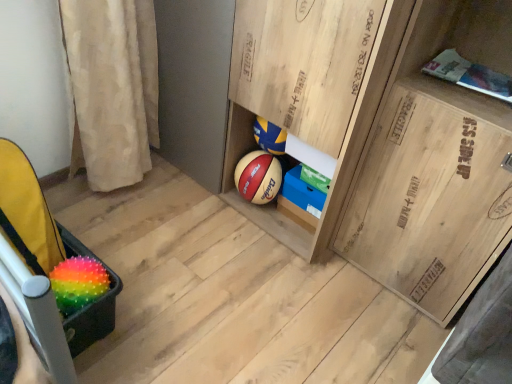
Image resolution: width=512 pixels, height=384 pixels. I want to click on free spot in front of wooden cabinet at center, placed as the third cabinetry when sorted from right to left, so click(240, 281).